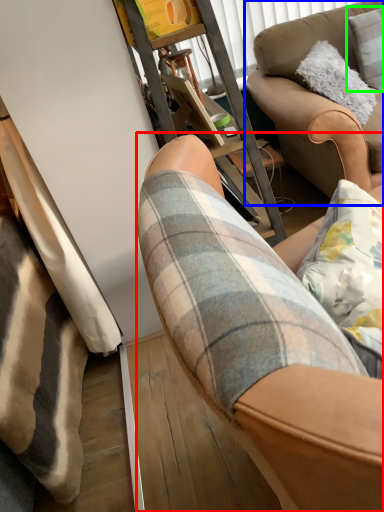
Question: Which object is positioned farthest from chair (highlighted by a red box)? Select from studio couch (highlighted by a blue box) and pillow (highlighted by a green box).

Choices:
 (A) studio couch
 (B) pillow

Answer: (B)